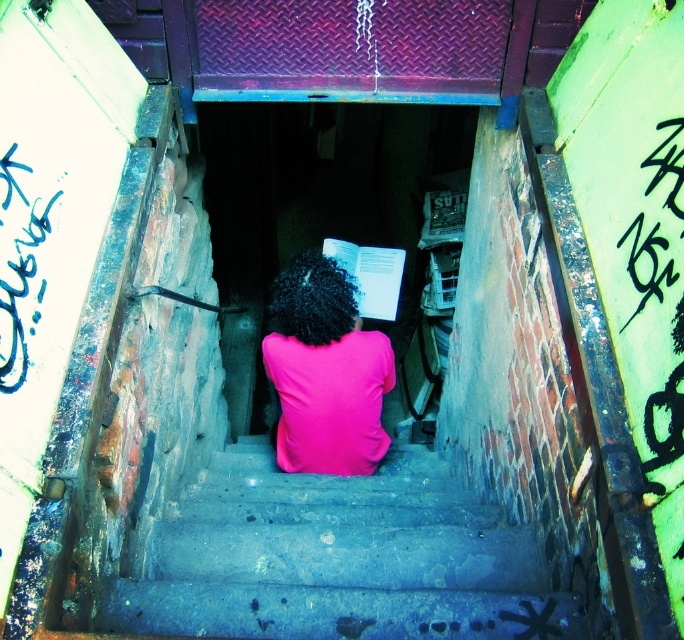
Question: Among these points, which one is farthest from the camera?

Choices:
 (A) (434, 540)
 (B) (345, 397)

Answer: (B)

Question: Does smooth concrete stairs at center have a greater width compared to pink matte shirt at center?

Choices:
 (A) no
 (B) yes

Answer: (B)

Question: Can you confirm if smooth concrete stairs at center is positioned below pink matte shirt at center?

Choices:
 (A) yes
 (B) no

Answer: (A)

Question: Considering the relative positions of smooth concrete stairs at center and pink matte shirt at center in the image provided, where is smooth concrete stairs at center located with respect to pink matte shirt at center?

Choices:
 (A) right
 (B) left

Answer: (A)

Question: Among these objects, which one is farthest from the camera?

Choices:
 (A) pink matte shirt at center
 (B) smooth concrete stairs at center

Answer: (A)